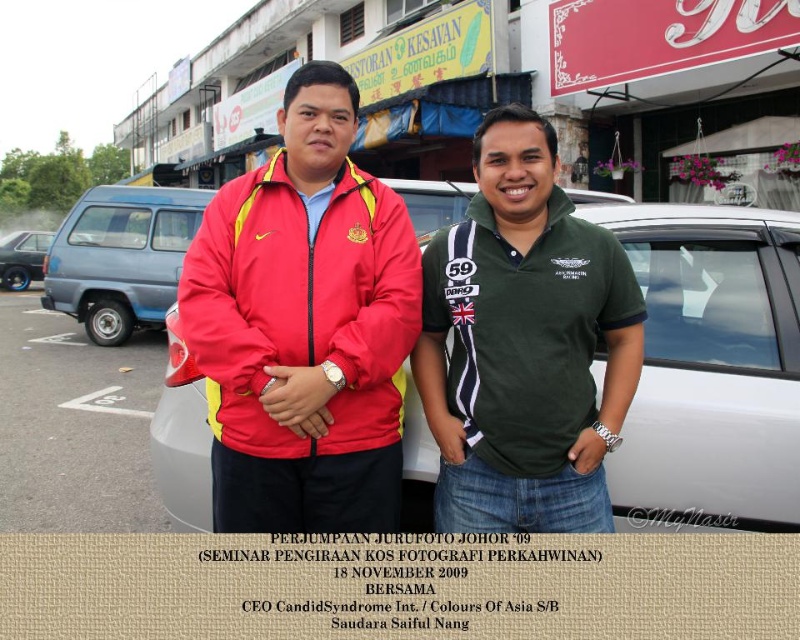
You are a fashion designer analyzing the image. You need to place a new accessory exactly at the same 2D coordinates as the green cotton polo shirt at center. What are the coordinates you should use?

The coordinates for the green cotton polo shirt at center are at point (524, 344), so you should place the accessory at those exact coordinates.